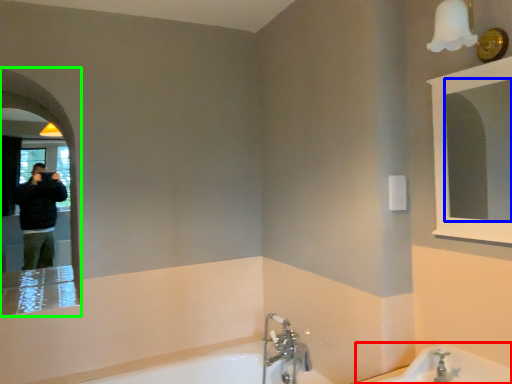
Question: Considering the real-world distances, which object is closest to bath (highlighted by a red box)? mirror (highlighted by a blue box) or mirror (highlighted by a green box).

Choices:
 (A) mirror
 (B) mirror

Answer: (B)